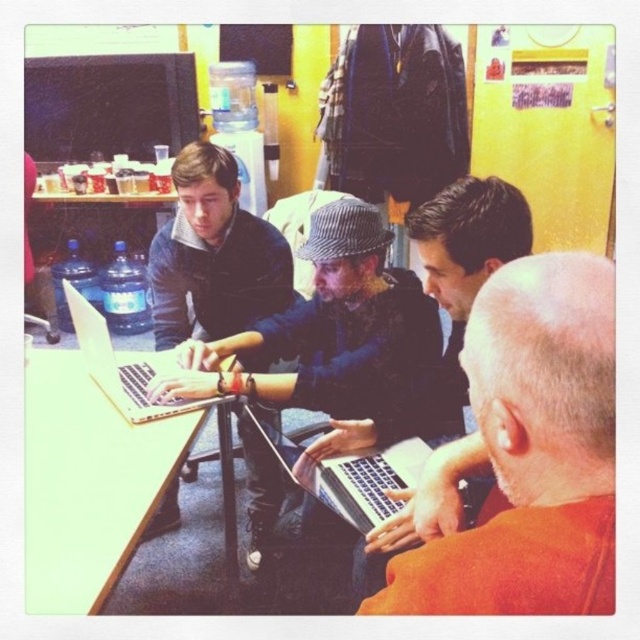
From the picture: Can you confirm if matte black laptop at center is shorter than matte black laptop at left?

Yes.

Between matte black laptop at center and matte black laptop at left, which one appears on the left side from the viewer's perspective?

From the viewer's perspective, matte black laptop at left appears more on the left side.

Between point (364, 285) and point (172, 236), which one is positioned in front?

Point (364, 285)

The height and width of the screenshot is (640, 640). Identify the location of matte black laptop at center. (339, 337).

Who is shorter, orange matte shirt at lower right or matte black laptop at left?

With less height is orange matte shirt at lower right.

Looking at this image, is orange matte shirt at lower right to the right of matte black laptop at left from the viewer's perspective?

Correct, you'll find orange matte shirt at lower right to the right of matte black laptop at left.

Does point (568, 340) come closer to viewer compared to point (170, 252)?

That is True.

Find the location of a particular element. The height and width of the screenshot is (640, 640). orange matte shirt at lower right is located at coordinates (525, 454).

Can you confirm if orange matte shirt at lower right is wider than matte black laptop at center?

No.

Consider the image. Who is higher up, orange matte shirt at lower right or matte black laptop at center?

matte black laptop at center is higher up.

The width and height of the screenshot is (640, 640). In order to click on orange matte shirt at lower right in this screenshot , I will do `click(525, 454)`.